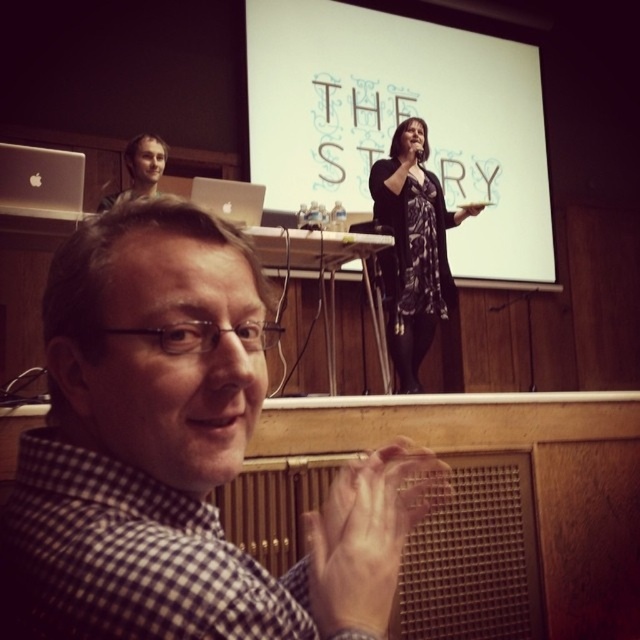
Question: Which object appears farthest from the camera in this image?

Choices:
 (A) black floral dress at center
 (B) matte silver laptop at upper center

Answer: (A)

Question: Considering the real-world distances, which object is closest to the matte silver laptop at upper left?

Choices:
 (A) black floral dress at center
 (B) matte silver laptop at upper center

Answer: (B)

Question: Does white matte projection screen at upper center appear on the left side of black floral dress at center?

Choices:
 (A) yes
 (B) no

Answer: (B)

Question: Which of the following is the farthest from the observer?

Choices:
 (A) (458, 321)
 (B) (58, 211)
 (C) (234, 186)

Answer: (A)

Question: Is matte silver laptop at upper left smaller than matte black hair at upper left?

Choices:
 (A) no
 (B) yes

Answer: (B)

Question: In this image, where is black floral dress at center located relative to matte black hair at upper left?

Choices:
 (A) right
 (B) left

Answer: (A)